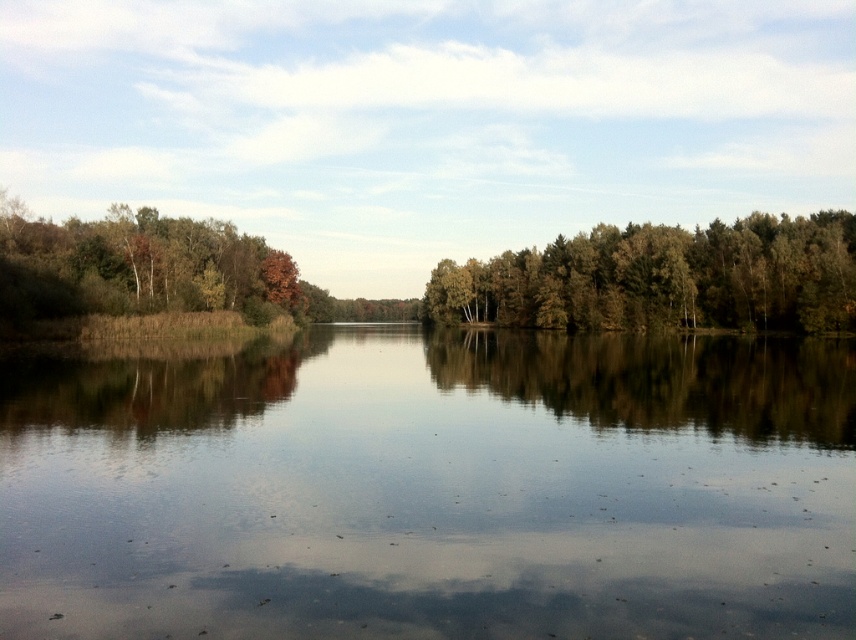
Can you confirm if smooth water at center is positioned above brown matte tree at left?

Incorrect, smooth water at center is not positioned above brown matte tree at left.

Between point (589, 422) and point (111, 232), which one is positioned in front?

Point (589, 422)

The width and height of the screenshot is (856, 640). I want to click on smooth water at center, so click(432, 490).

Where is `smooth water at center`? smooth water at center is located at coordinates (432, 490).

Is green leafy forest at center to the left of green leafy trees at center from the viewer's perspective?

Yes, green leafy forest at center is to the left of green leafy trees at center.

The width and height of the screenshot is (856, 640). What do you see at coordinates (447, 275) in the screenshot? I see `green leafy forest at center` at bounding box center [447, 275].

Describe the element at coordinates (447, 275) in the screenshot. The image size is (856, 640). I see `green leafy forest at center` at that location.

Locate an element on the screen. The width and height of the screenshot is (856, 640). green leafy forest at center is located at coordinates (447, 275).

Does point (437, 532) come farther from viewer compared to point (738, 243)?

No, (437, 532) is closer to viewer.

Who is positioned more to the left, smooth water at center or green leafy trees at center?

From the viewer's perspective, smooth water at center appears more on the left side.

I want to click on smooth water at center, so click(432, 490).